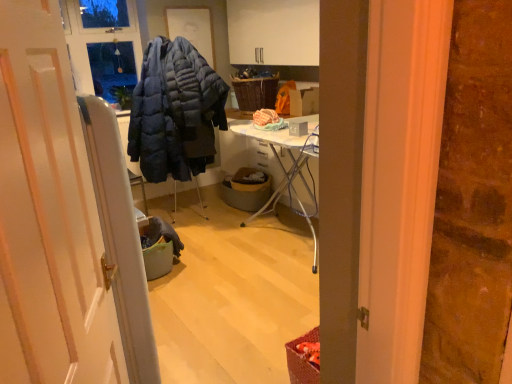
What are the coordinates of `woven brown picnic basket at center` in the screenshot? It's located at (255, 92).

Locate an element on the screen. The height and width of the screenshot is (384, 512). brown woven basket at center is located at coordinates (245, 191).

Is point (90, 365) more distant than point (267, 194)?

No, it is in front of (267, 194).

Considering the sizes of white glossy door at center and brown woven basket at center in the image, is white glossy door at center taller or shorter than brown woven basket at center?

In the image, white glossy door at center appears to be taller than brown woven basket at center.

What's the angular difference between white glossy door at center and brown woven basket at center's facing directions?

The angular difference between white glossy door at center and brown woven basket at center is 137 degrees.

Is white glossy door at center far from brown woven basket at center?

white glossy door at center is far away from brown woven basket at center.

Does brown woven basket at center have a greater height compared to white glossy door at center?

No.

Is brown woven basket at center at the left side of white glossy door at center?

No, brown woven basket at center is not to the left of white glossy door at center.

Is brown woven basket at center touching white glossy door at center?

No, brown woven basket at center is not making contact with white glossy door at center.

In terms of size, does brown woven basket at center appear bigger or smaller than white glossy door at center?

Considering their sizes, brown woven basket at center takes up less space than white glossy door at center.

From the image's perspective, which is below, woven brown picnic basket at center or brown woven basket at center?

brown woven basket at center appears lower in the image.

This screenshot has width=512, height=384. What are the coordinates of `trash bin/can that is below the woven brown picnic basket at center (from the image's perspective)` in the screenshot? It's located at (245, 191).

Would you say woven brown picnic basket at center is inside or outside brown woven basket at center?

woven brown picnic basket at center lies outside brown woven basket at center.

Is woven brown picnic basket at center next to brown woven basket at center?

There is a gap between woven brown picnic basket at center and brown woven basket at center.

You are a GUI agent. You are given a task and a screenshot of the screen. Output one action in this format:
    pyautogui.click(x=<x>, y=<y>)
    Task: Click on the picnic basket behind the white glossy door at center
    This screenshot has width=512, height=384.
    Given the screenshot: What is the action you would take?
    [255, 92]

Considering the relative positions of woven brown picnic basket at center and white glossy door at center in the image provided, is woven brown picnic basket at center to the right of white glossy door at center from the viewer's perspective?

Correct, you'll find woven brown picnic basket at center to the right of white glossy door at center.

Measure the distance from woven brown picnic basket at center to white glossy door at center.

3.42 meters.

Between woven brown picnic basket at center and white glossy door at center, which one has smaller size?

woven brown picnic basket at center.

Is woven brown picnic basket at center completely or partially inside white glossy door at center?

No, woven brown picnic basket at center is located outside of white glossy door at center.

Does white glossy door at center come behind woven brown picnic basket at center?

No, white glossy door at center is closer to the viewer.

Locate an element on the screen. The height and width of the screenshot is (384, 512). picnic basket located above the white glossy door at center (from the image's perspective) is located at coordinates (255, 92).

Is point (247, 186) closer or farther from the camera than point (273, 80)?

Point (247, 186).

What's the angular difference between brown woven basket at center and woven brown picnic basket at center's facing directions?

The angle between the facing direction of brown woven basket at center and the facing direction of woven brown picnic basket at center is 12.8 degrees.

From the image's perspective, is brown woven basket at center positioned above or below woven brown picnic basket at center?

brown woven basket at center is below woven brown picnic basket at center.

In the image, is brown woven basket at center positioned in front of or behind woven brown picnic basket at center?

Visually, brown woven basket at center is located in front of woven brown picnic basket at center.

Find the location of `door lying on the left of brown woven basket at center`. door lying on the left of brown woven basket at center is located at coordinates (54, 214).

At what (x,y) coordinates should I click in order to perform the action: click on trash bin/can on the right of white glossy door at center. Please return your answer as a coordinate pair (x, y). This screenshot has width=512, height=384. Looking at the image, I should click on (245, 191).

Looking at the image, which one is located further to brown woven basket at center, white glossy door at center or woven brown picnic basket at center?

The object further to brown woven basket at center is white glossy door at center.

From the image, which object appears to be farther from white glossy door at center, brown woven basket at center or woven brown picnic basket at center?

The object further to white glossy door at center is woven brown picnic basket at center.

From the image, which object appears to be nearer to white glossy door at center, woven brown picnic basket at center or brown woven basket at center?

brown woven basket at center is positioned closer to the anchor white glossy door at center.

Based on their spatial positions, is brown woven basket at center or white glossy door at center further from woven brown picnic basket at center?

white glossy door at center is further to woven brown picnic basket at center.

Estimate the real-world distances between objects in this image. Which object is closer to woven brown picnic basket at center, white glossy door at center or brown woven basket at center?

Among the two, brown woven basket at center is located nearer to woven brown picnic basket at center.

Considering their positions, is woven brown picnic basket at center positioned further to brown woven basket at center than white glossy door at center?

white glossy door at center is positioned further to the anchor brown woven basket at center.

This screenshot has height=384, width=512. I want to click on trash bin/can between white glossy door at center and woven brown picnic basket at center along the z-axis, so click(245, 191).